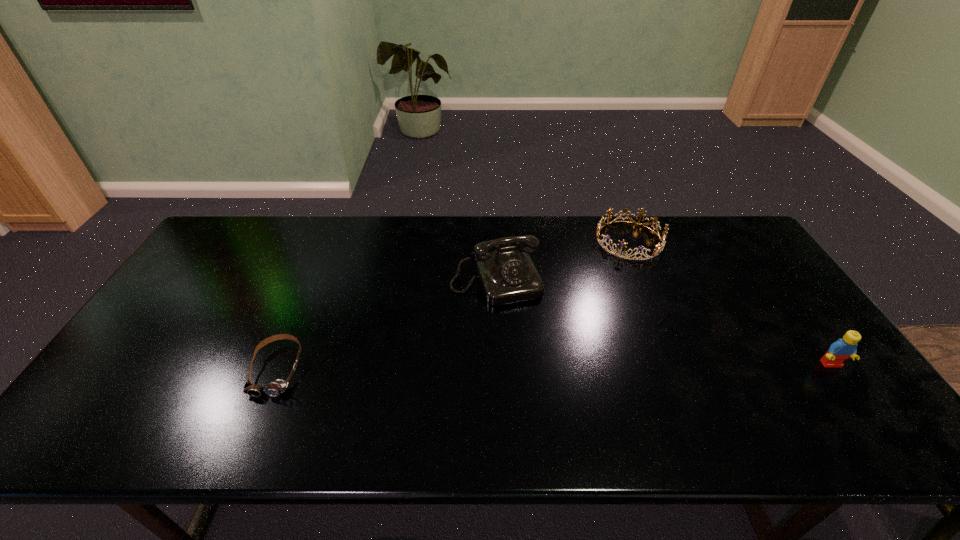
Where is `vacant spot on the desktop that is between the shortest object and the Lego and is positioned on the dial of the second object from left to right`? The height and width of the screenshot is (540, 960). vacant spot on the desktop that is between the shortest object and the Lego and is positioned on the dial of the second object from left to right is located at coordinates [x=528, y=367].

Locate an element on the screen. This screenshot has height=540, width=960. vacant space on the desktop that is between the leftmost object and the rightmost object and is positioned on the front-facing side of the third object from left to right is located at coordinates point(558,367).